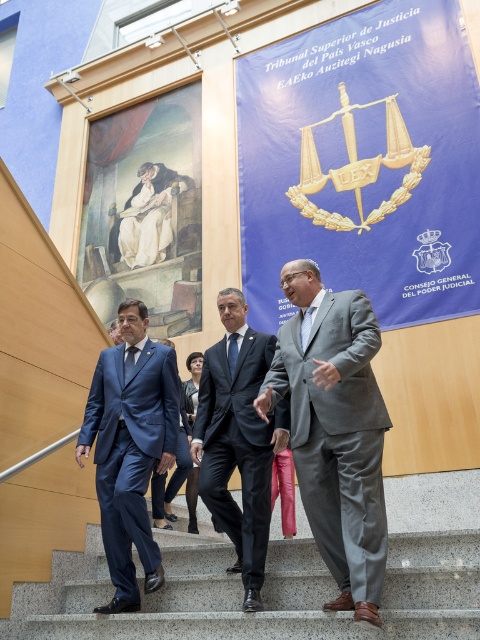
Question: Is granite stairs at center positioned in front of dark blue suit at center?

Choices:
 (A) yes
 (B) no

Answer: (A)

Question: Which point is farther to the camera?

Choices:
 (A) matte blue suit at center
 (B) dark blue suit at center

Answer: (A)

Question: Can you confirm if matte blue suit at center is positioned below dark blue suit at center?

Choices:
 (A) no
 (B) yes

Answer: (B)

Question: Does blue fabric banner at center have a smaller size compared to matte blue suit at center?

Choices:
 (A) no
 (B) yes

Answer: (A)

Question: Which object appears closest to the camera in this image?

Choices:
 (A) matte blue suit at center
 (B) dark blue suit at center

Answer: (B)

Question: Which object is positioned farthest from the dark blue suit at center?

Choices:
 (A) gray suit at center
 (B) blue fabric banner at center
 (C) granite stairs at center
 (D) matte blue suit at center

Answer: (B)